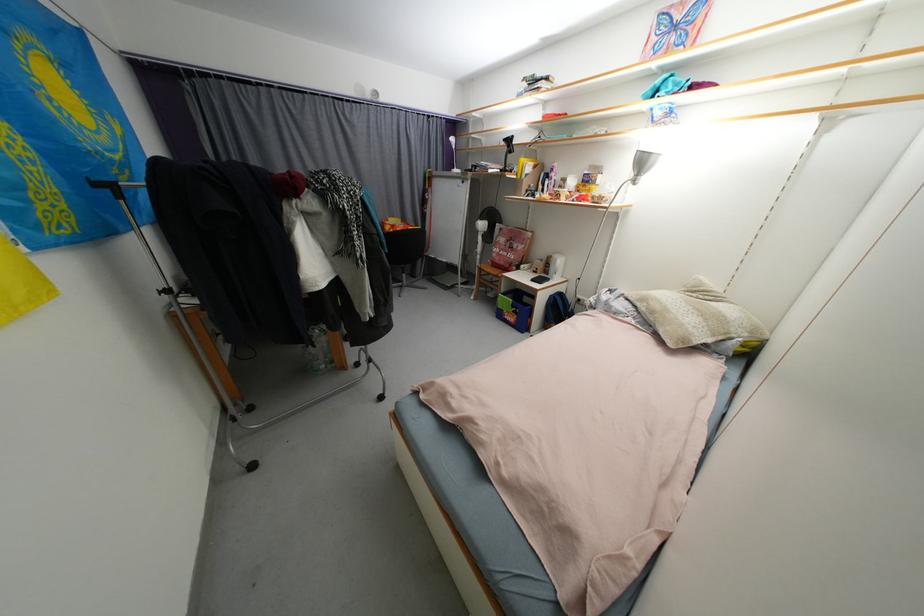
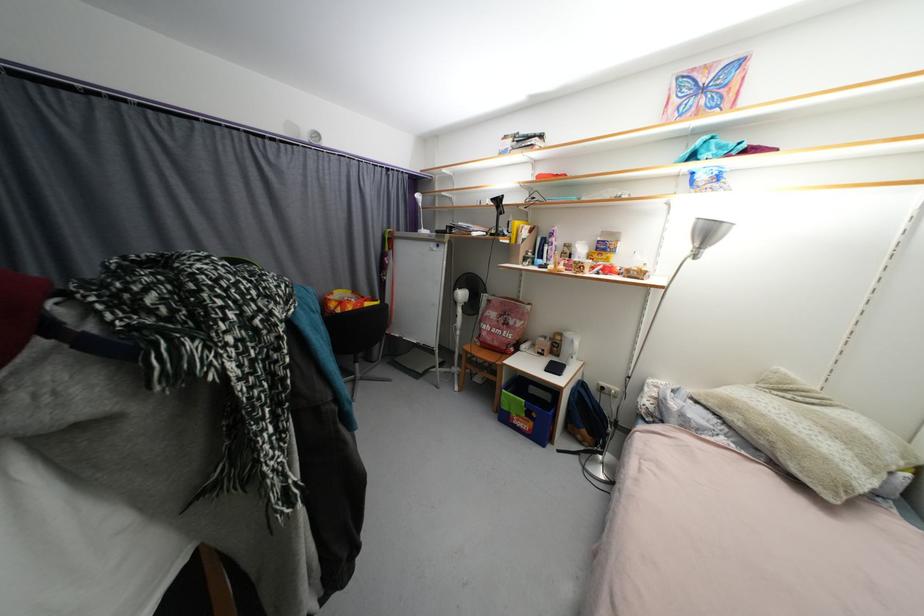
The images are taken continuously from a first-person perspective. In which direction are you moving?

The cameraman walked toward left, forward.